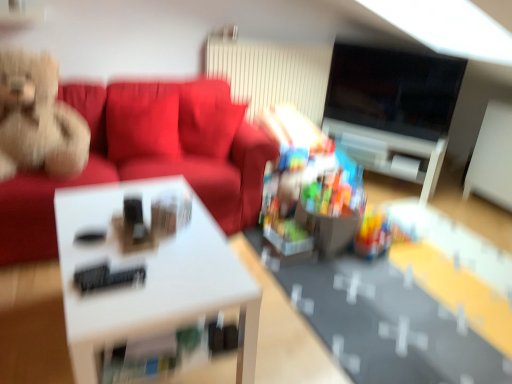
Question: From the image's perspective, is white glossy table at center above or below fluffy beige teddy bear on the left, the first toy from the top?

Choices:
 (A) below
 (B) above

Answer: (A)

Question: Does point (181, 302) appear closer or farther from the camera than point (42, 97)?

Choices:
 (A) closer
 (B) farther

Answer: (A)

Question: Considering the real-world distances, which object is farthest from the suede-like red couch at upper left?

Choices:
 (A) white glossy table at center
 (B) translucent plastic toy at center, the second toy in the top-to-bottom sequence
 (C) fluffy beige teddy bear on the left, the 2th toy viewed from the right
 (D) black glossy tv at upper right

Answer: (D)

Question: Estimate the real-world distances between objects in this image. Which object is farther from the black glossy tv at upper right?

Choices:
 (A) white glossy table at center
 (B) suede-like red couch at upper left
 (C) translucent plastic toy at center, the 2th toy from the left
 (D) fluffy beige teddy bear on the left, the 2th toy viewed from the right

Answer: (D)